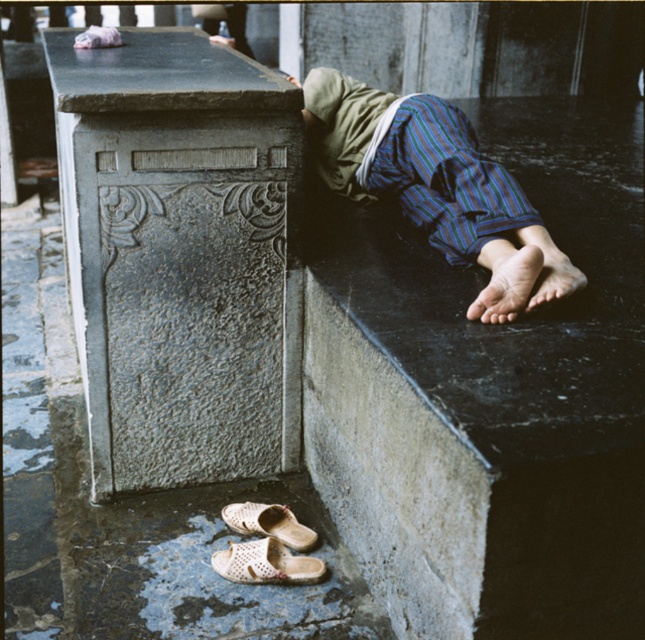
Does striped fabric legs at lower right have a lesser width compared to white woven sandal at lower center?

No.

Does striped fabric legs at lower right appear over white woven sandal at lower center?

Correct, striped fabric legs at lower right is located above white woven sandal at lower center.

Find the location of a particular element. Image resolution: width=645 pixels, height=640 pixels. striped fabric legs at lower right is located at coordinates (437, 186).

Which of these two, black marble concrete at upper right or striped fabric legs at lower right, stands taller?

Standing taller between the two is black marble concrete at upper right.

Does point (439, 301) come closer to viewer compared to point (417, 202)?

Yes, point (439, 301) is closer to viewer.

Where is `black marble concrete at upper right`? This screenshot has width=645, height=640. black marble concrete at upper right is located at coordinates (488, 396).

Who is positioned more to the right, dry skin foot at lower right or white woven sandal at lower center?

From the viewer's perspective, dry skin foot at lower right appears more on the right side.

Is point (528, 269) positioned in front of point (273, 550)?

Yes, point (528, 269) is closer to viewer.

Which is in front, point (477, 314) or point (215, 566)?

Positioned in front is point (477, 314).

Where is `dry skin foot at lower right`? dry skin foot at lower right is located at coordinates (504, 280).